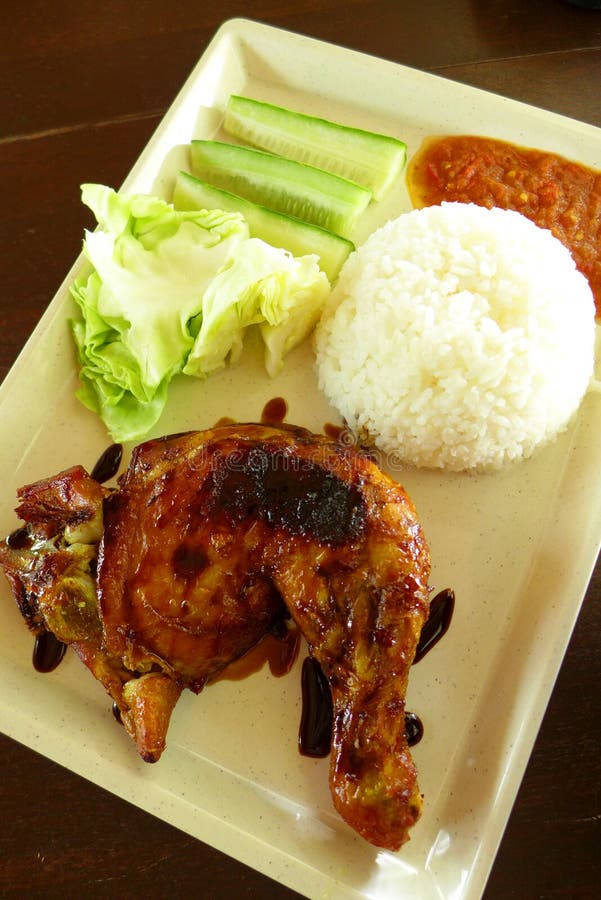
Where is `raised edge of plate`? raised edge of plate is located at coordinates (175, 797), (555, 645), (31, 346), (492, 101).